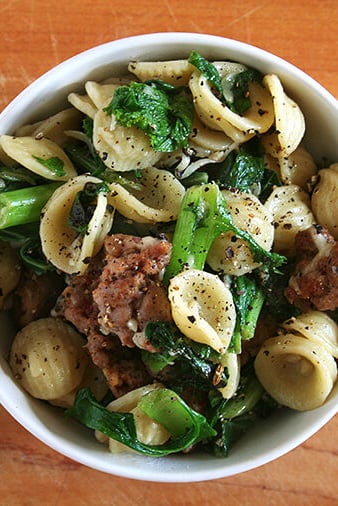
Find the location of a particular element. This screenshot has height=506, width=338. scuffs on table is located at coordinates point(55,51), point(40,467), point(175,18).